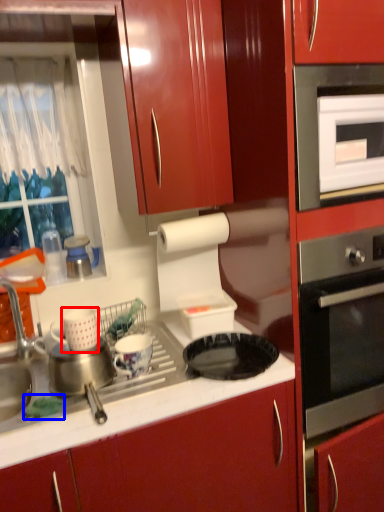
Question: Among these objects, which one is nearest to the camera, appliance (highlighted by a red box) or food (highlighted by a blue box)?

Choices:
 (A) appliance
 (B) food

Answer: (B)